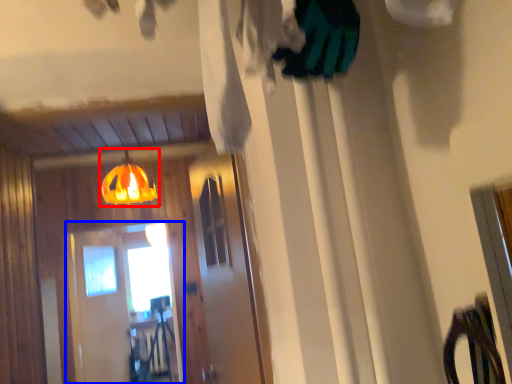
Question: Which of the following is the farthest to the observer, lamp (highlighted by a red box) or screen door (highlighted by a blue box)?

Choices:
 (A) lamp
 (B) screen door

Answer: (B)